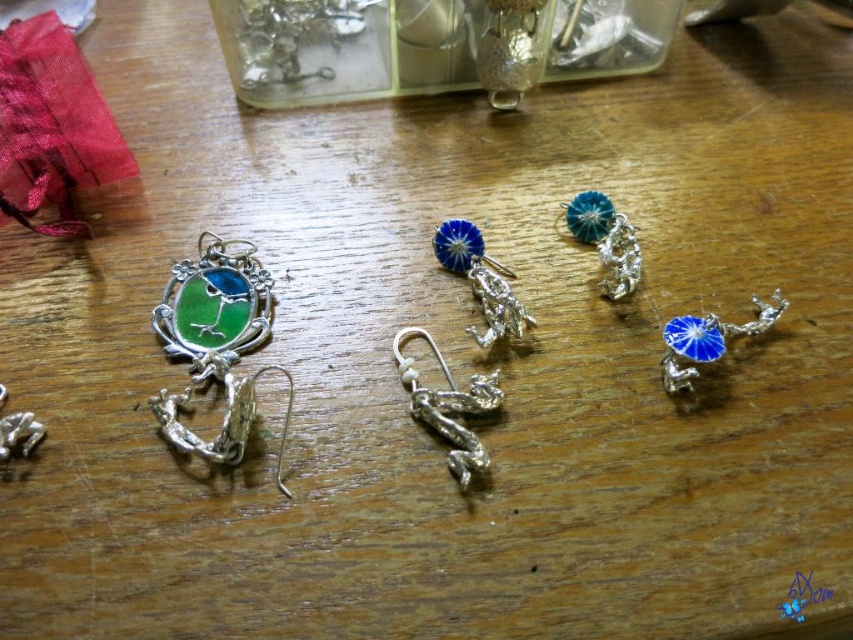
Question: Which of the following is the closest to the observer?

Choices:
 (A) (468, 470)
 (B) (686, 353)

Answer: (A)

Question: Which point is closer to the camera?

Choices:
 (A) silver metallic hook at center
 (B) blue enamel charm at right

Answer: (A)

Question: Which object appears closest to the camera in this image?

Choices:
 (A) blue enamel charm at right
 (B) silver metallic hook at center

Answer: (B)

Question: Is silver metallic hook at center to the left of blue enamel charm at right from the viewer's perspective?

Choices:
 (A) no
 (B) yes

Answer: (B)

Question: Can you confirm if silver metallic hook at center is positioned to the right of blue enamel charm at right?

Choices:
 (A) yes
 (B) no

Answer: (B)

Question: Can you confirm if silver metallic hook at center is bigger than blue enamel charm at right?

Choices:
 (A) yes
 (B) no

Answer: (A)